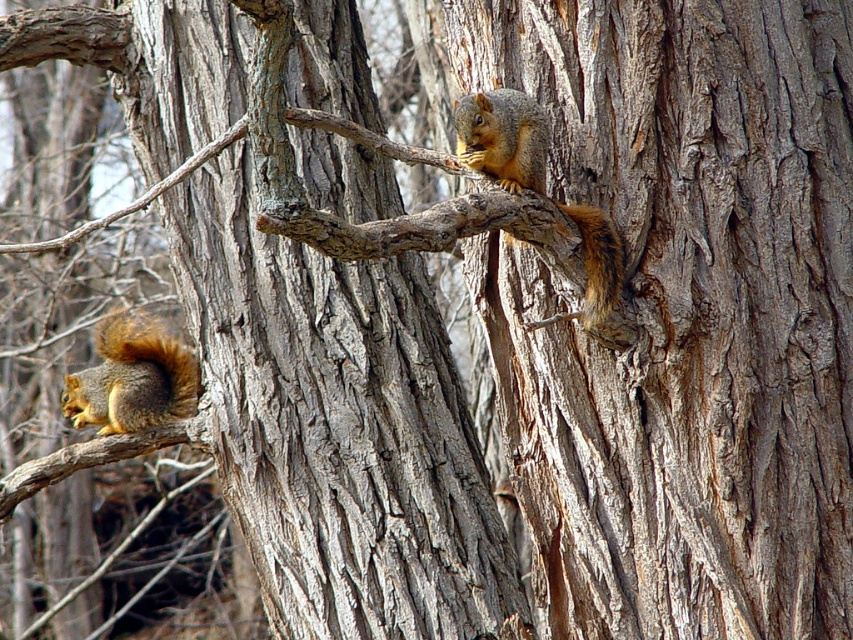
Question: Which point is closer to the camera taking this photo?

Choices:
 (A) (596, 236)
 (B) (97, 326)

Answer: (A)

Question: Which object appears farthest from the camera in this image?

Choices:
 (A) brown fur squirrel at upper right
 (B) brown fuzzy tail at upper right

Answer: (B)

Question: In this image, where is gray rough bark tree trunk at center located relative to shiny brown fur squirrel at lower left?

Choices:
 (A) below
 (B) above

Answer: (B)

Question: Which of the following is the farthest from the observer?

Choices:
 (A) (268, 568)
 (B) (149, 381)
 (C) (73, 460)
 (D) (480, 144)

Answer: (B)

Question: Does brown rough tree branch at lower left appear on the right side of brown fuzzy tail at upper right?

Choices:
 (A) no
 (B) yes

Answer: (A)

Question: Observing the image, what is the correct spatial positioning of grayish-brown bark tree trunk at center in reference to gray rough bark tree trunk at center?

Choices:
 (A) below
 (B) above

Answer: (A)